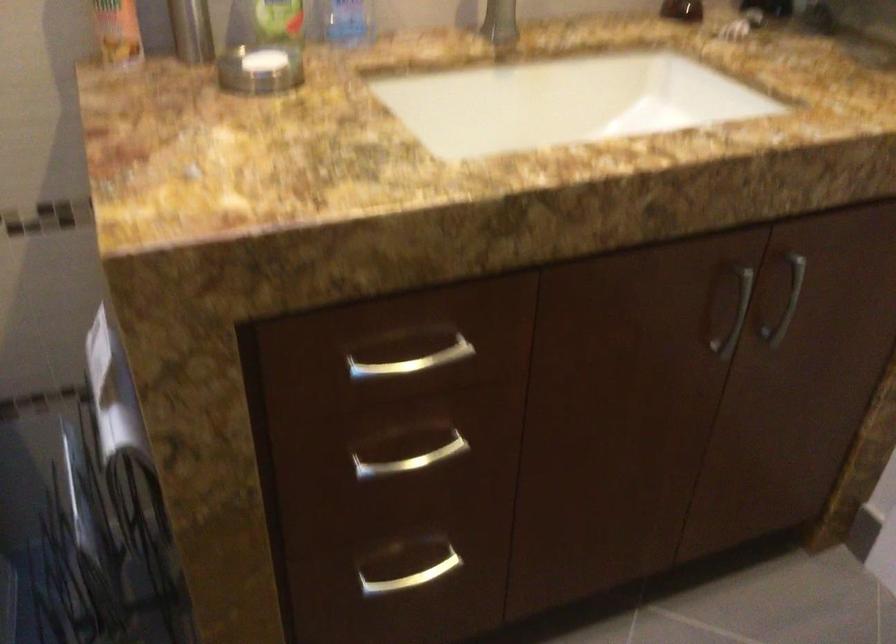
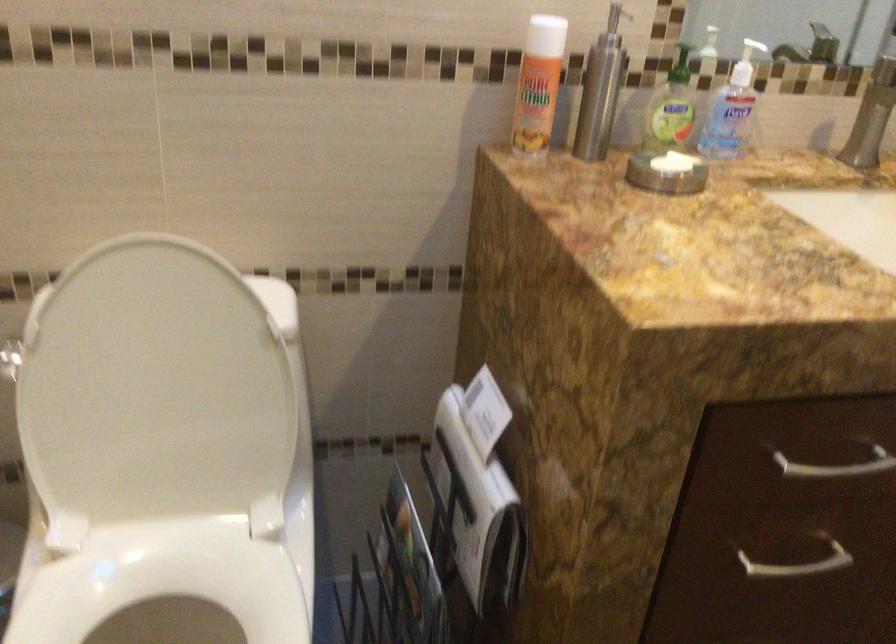
Locate, in the second image, the point that corresponds to (427,460) in the first image.

(797, 565)